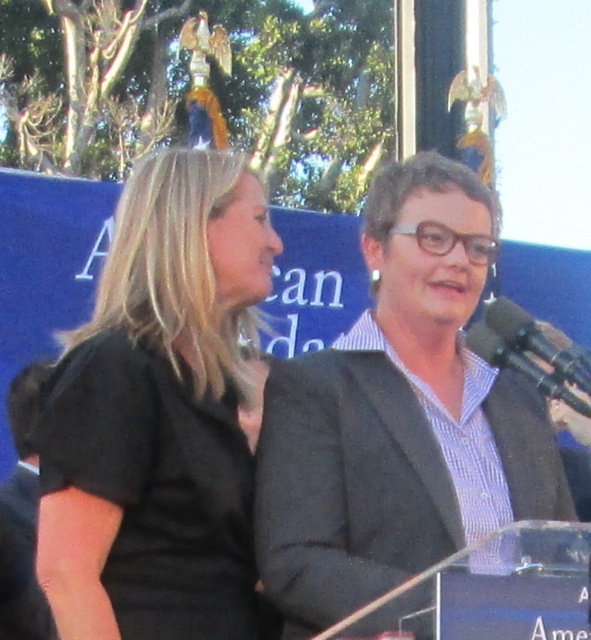
Question: Can you confirm if black matte shirt at center is positioned to the left of matte gray blazer at center?

Choices:
 (A) yes
 (B) no

Answer: (A)

Question: Is black matte shirt at center above matte gray blazer at center?

Choices:
 (A) yes
 (B) no

Answer: (B)

Question: Among these objects, which one is nearest to the camera?

Choices:
 (A) matte gray blazer at center
 (B) black matte shirt at center

Answer: (A)

Question: Which object is farther from the camera taking this photo?

Choices:
 (A) black matte shirt at center
 (B) black plastic microphone at right

Answer: (B)

Question: Is black matte shirt at center positioned in front of black plastic microphone at right?

Choices:
 (A) yes
 (B) no

Answer: (A)

Question: Among these points, which one is nearest to the camera?

Choices:
 (A) (63, 451)
 (B) (570, 392)

Answer: (A)